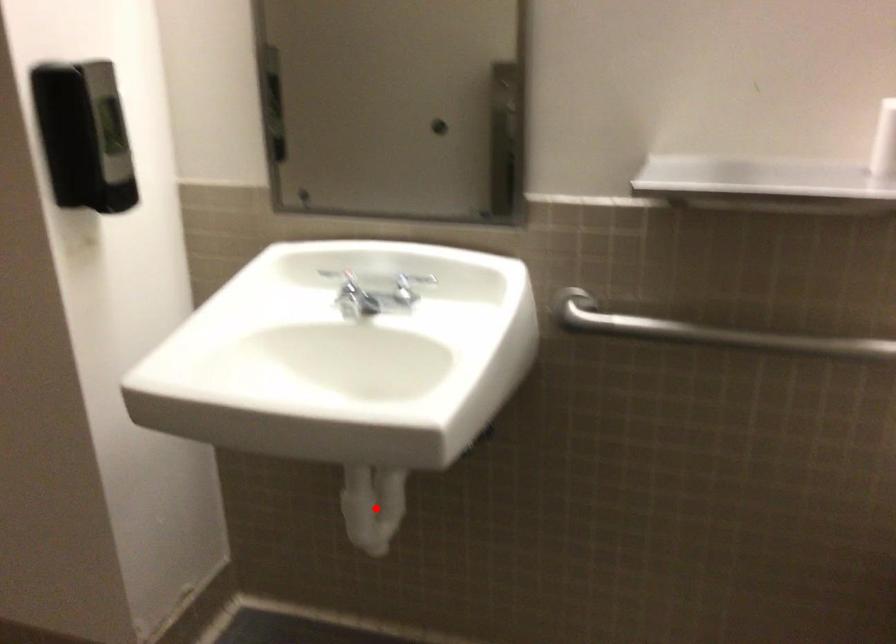
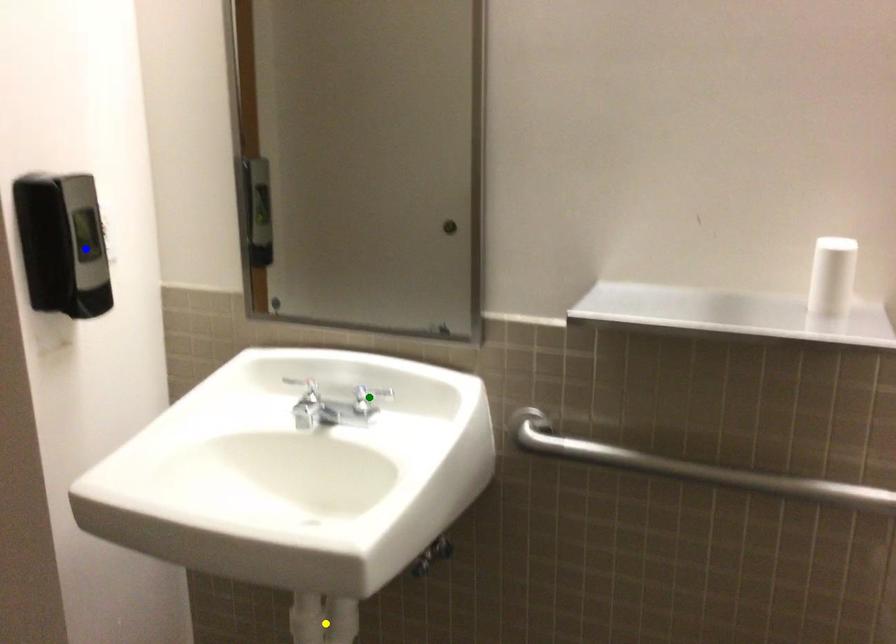
Question: I am providing you with two images of the same scene from different viewpoints. A red point is marked on the first image. You are given multiple points on the second image. Which point in image 2 represents the same 3d spot as the red point in image 1?

Choices:
 (A) blue point
 (B) green point
 (C) yellow point

Answer: (C)